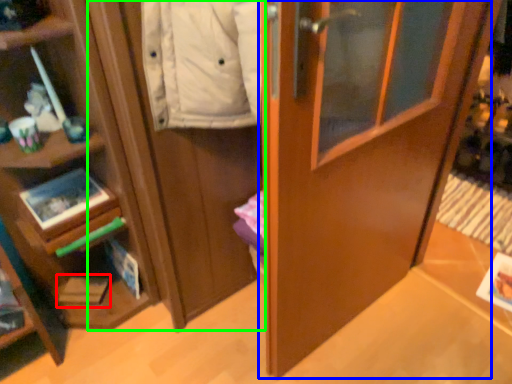
Question: Which is farther away from magazine (highlighted by a red box)? door (highlighted by a blue box) or cabinetry (highlighted by a green box)?

Choices:
 (A) door
 (B) cabinetry

Answer: (A)